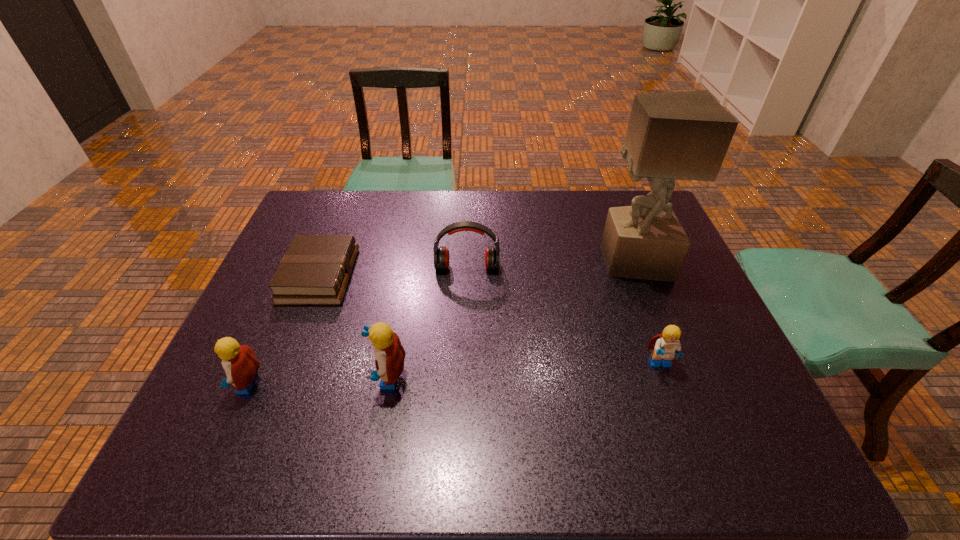
Image resolution: width=960 pixels, height=540 pixels. What are the coordinates of `vacant space located 0.070m on the front-facing side of the second shortest object` in the screenshot? It's located at (674, 404).

You are a GUI agent. You are given a task and a screenshot of the screen. Output one action in this format:
    pyautogui.click(x=<x>, y=<y>)
    Task: Click on the free spot located 0.140m on the ear cups of the third object from right to left
    
    Given the screenshot: What is the action you would take?
    pyautogui.click(x=466, y=310)

I want to click on vacant region located on the front-facing side of the tallest object, so click(486, 261).

Find the location of `vacant space located on the front-facing side of the tallest object`. vacant space located on the front-facing side of the tallest object is located at coordinates (499, 261).

This screenshot has width=960, height=540. In order to click on free space located on the front-facing side of the tallest object in this screenshot , I will do [x=571, y=261].

Where is `blank space located 0.320m on the spine side of the Bible`? The height and width of the screenshot is (540, 960). blank space located 0.320m on the spine side of the Bible is located at coordinates (465, 276).

The height and width of the screenshot is (540, 960). In order to click on Lego situated at the left edge in this screenshot , I will do `click(240, 364)`.

Image resolution: width=960 pixels, height=540 pixels. I want to click on Bible located at the left edge, so click(x=315, y=270).

Identify the location of Lego that is at the right edge. click(666, 345).

Find the location of `sculpture that is at the right edge`. sculpture that is at the right edge is located at coordinates (685, 135).